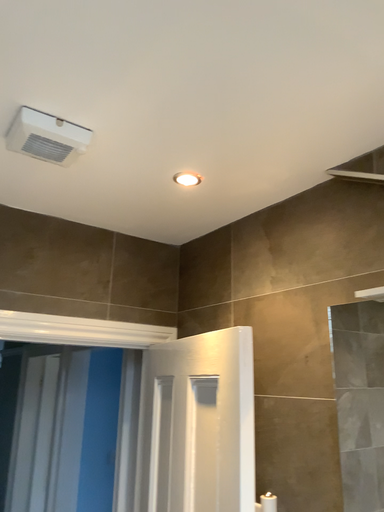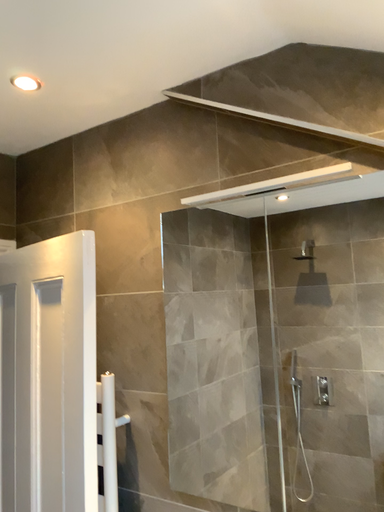
Question: Which way did the camera rotate in the video?

Choices:
 (A) rotated upward
 (B) rotated downward

Answer: (B)